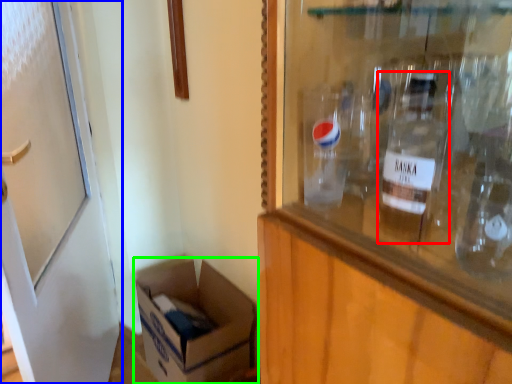
Question: Based on their relative distances, which object is farther from bottle (highlighted by a red box)? Choose from door (highlighted by a blue box) and box (highlighted by a green box).

Choices:
 (A) door
 (B) box

Answer: (B)